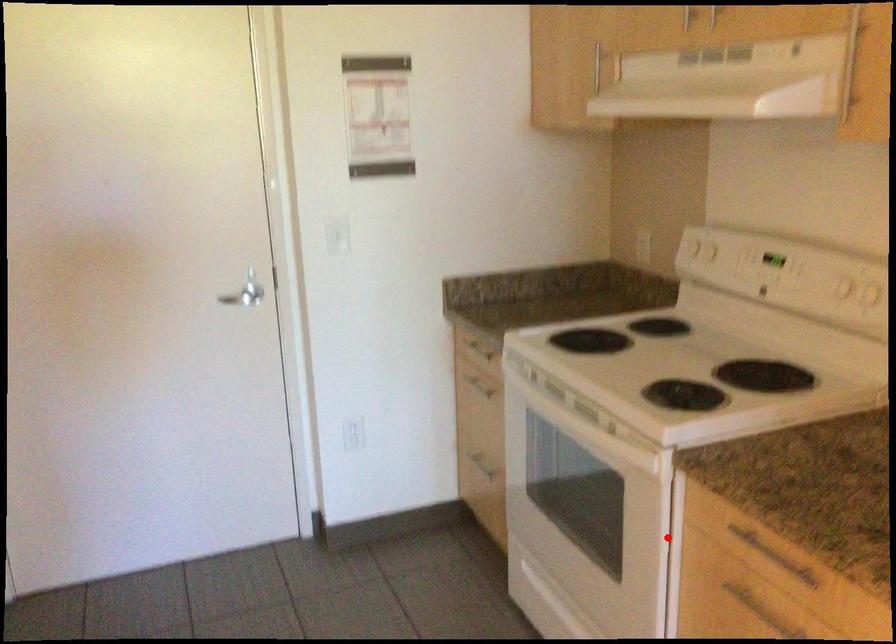
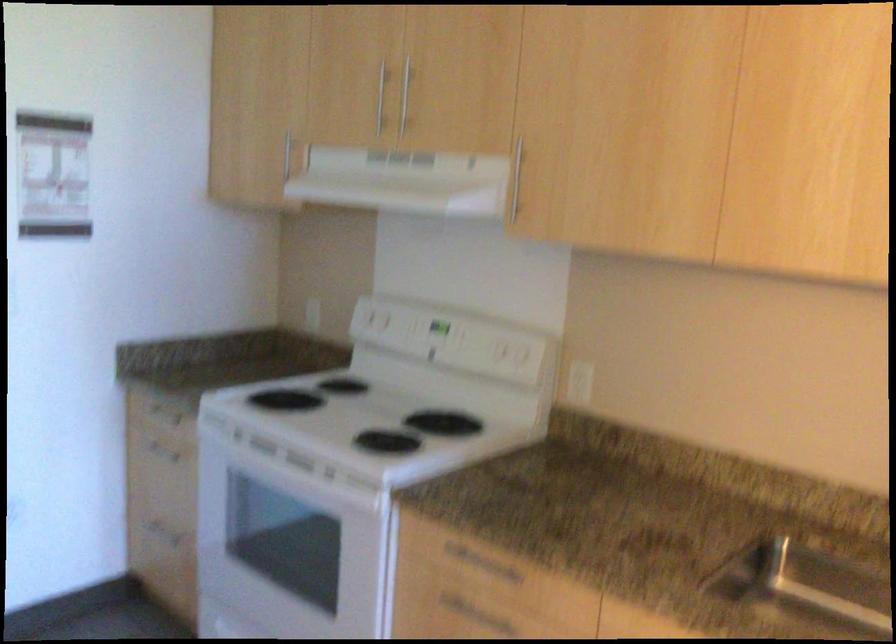
Locate, in the second image, the point that corresponds to the highlighted location in the first image.

(385, 571)